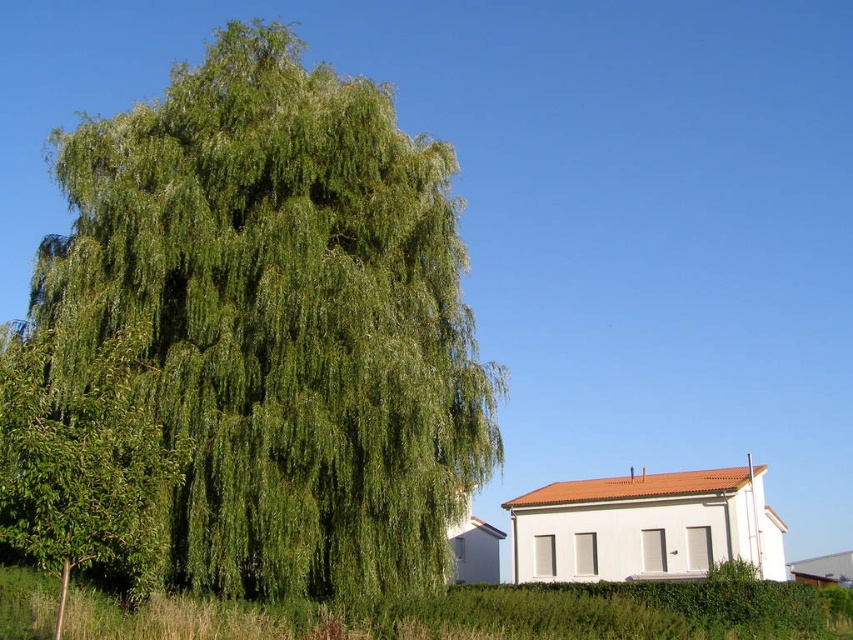
Question: Which point is closer to the camera?

Choices:
 (A) (103, 227)
 (B) (146, 486)

Answer: (B)

Question: Is green leafy willow at left wider than green leafy tree at left?

Choices:
 (A) yes
 (B) no

Answer: (A)

Question: Is green leafy willow at left to the right of green leafy tree at left from the viewer's perspective?

Choices:
 (A) no
 (B) yes

Answer: (B)

Question: From the image, what is the correct spatial relationship of green leafy willow at left in relation to green leafy tree at left?

Choices:
 (A) below
 (B) above

Answer: (B)